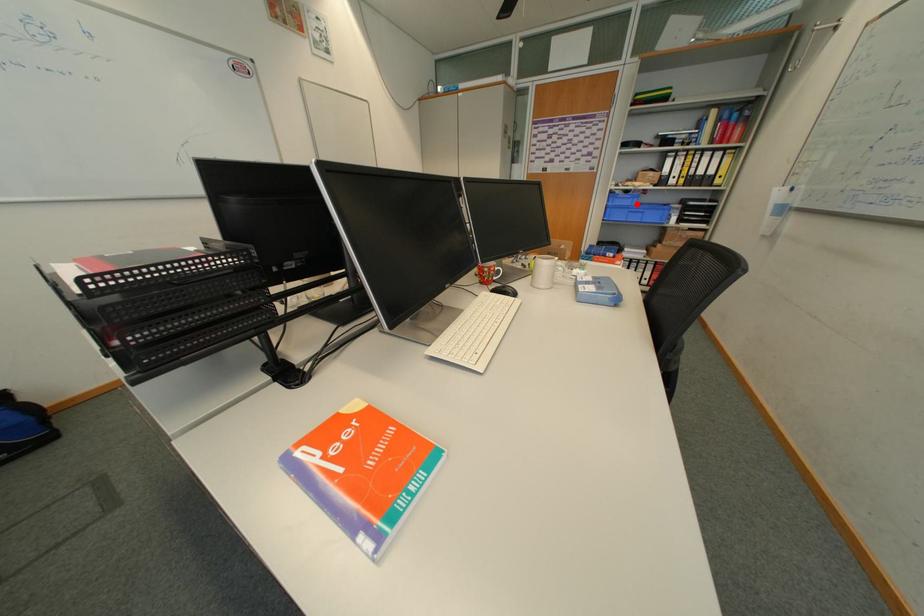
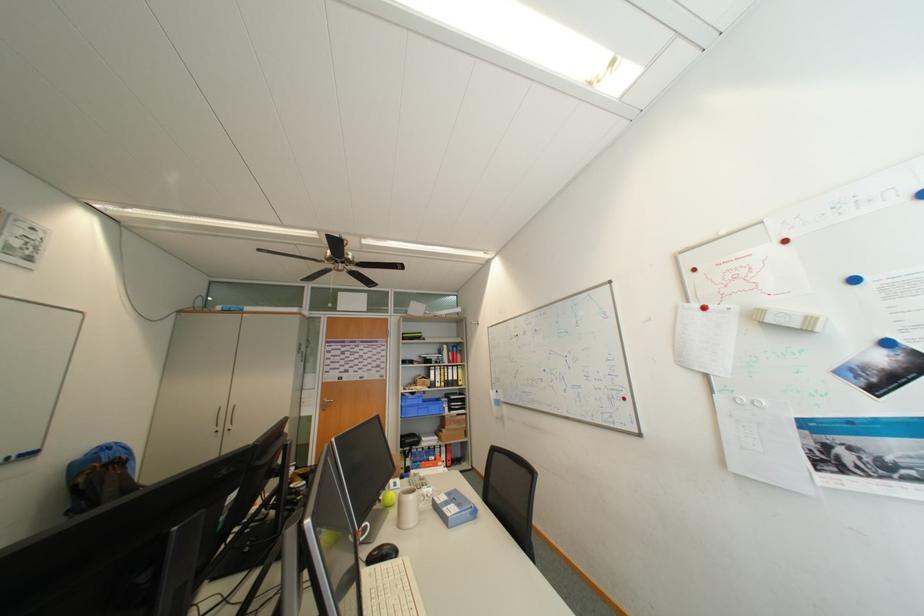
Where in the second image is the point corresponding to the highlighted location from the first image?

(426, 403)